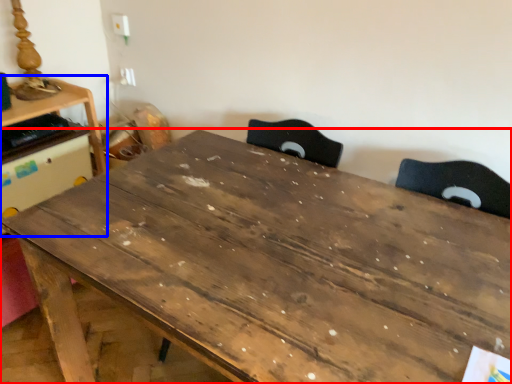
Question: Which point is closer to the camera, table (highlighted by a red box) or table (highlighted by a blue box)?

Choices:
 (A) table
 (B) table

Answer: (A)